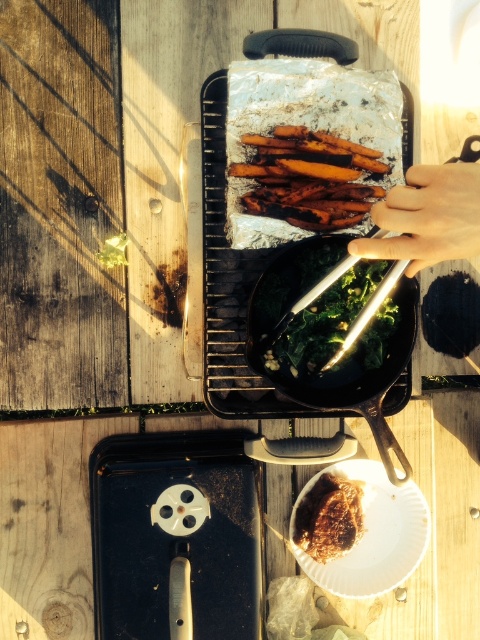
Measure the distance between charred wooden skewers at center and brown skin at center.

They are 13.89 inches apart.

Which is more to the right, charred wooden skewers at center or brown skin at center?

Positioned to the right is brown skin at center.

Is point (343, 160) behind point (439, 204)?

Yes, point (343, 160) is farther from viewer.

The width and height of the screenshot is (480, 640). I want to click on charred wooden skewers at center, so click(309, 179).

Who is positioned more to the left, brown paper plate at lower center or brown skin at center?

brown paper plate at lower center

Is point (335, 588) behind point (462, 186)?

Yes.

The width and height of the screenshot is (480, 640). Find the location of `brown paper plate at lower center`. brown paper plate at lower center is located at coordinates (372, 534).

At what (x,y) coordinates should I click in order to perform the action: click on brown paper plate at lower center. Please return your answer as a coordinate pair (x, y). Looking at the image, I should click on (372, 534).

Does brown paper plate at lower center appear on the right side of brown crispy meat at center?

Correct, you'll find brown paper plate at lower center to the right of brown crispy meat at center.

Is point (288, 525) closer to viewer compared to point (335, 552)?

No, (288, 525) is further to viewer.

Locate an element on the screen. The image size is (480, 640). brown paper plate at lower center is located at coordinates (372, 534).